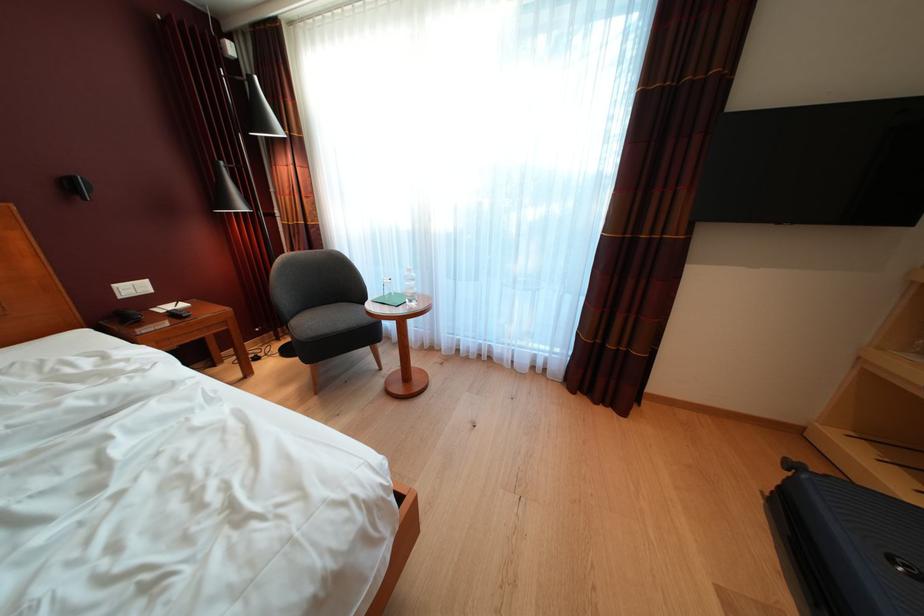
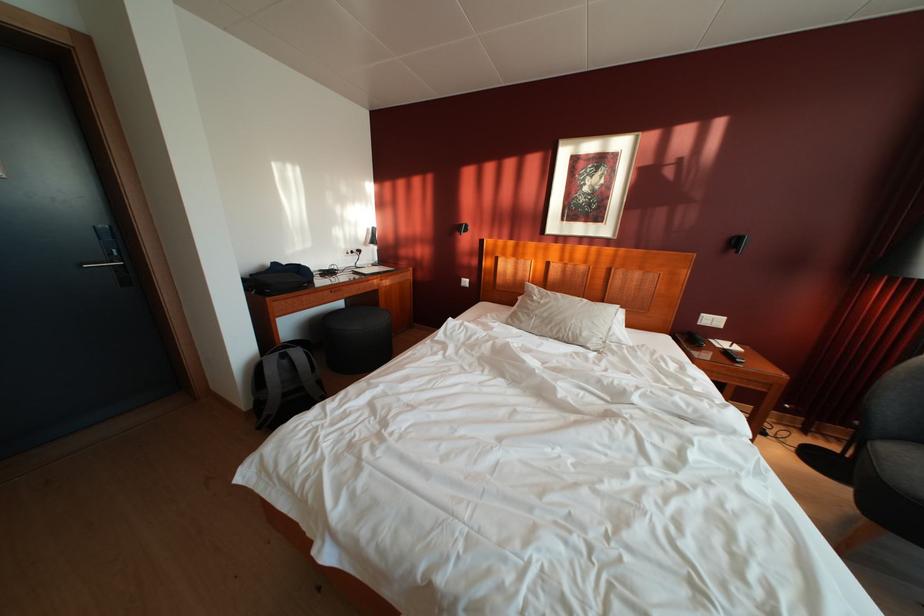
Find the pixel in the second image that matches [142,294] in the first image.

(721, 326)